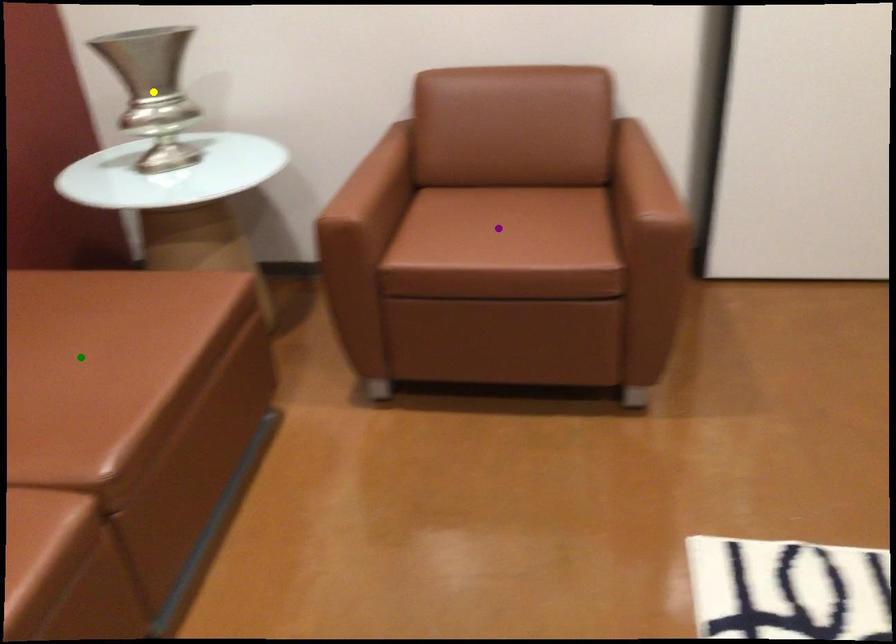
Order these from farthest to nearest:
yellow point
green point
purple point

yellow point → purple point → green point